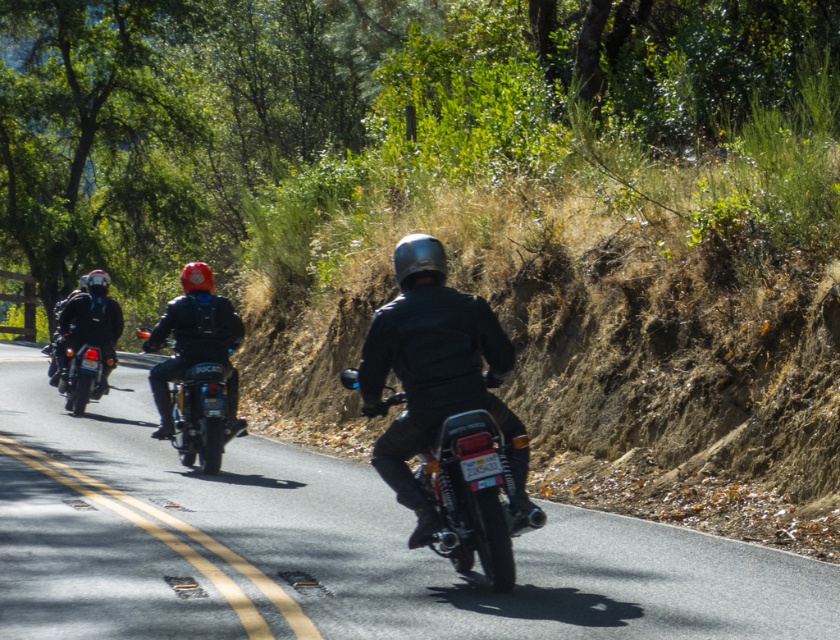
Can you confirm if shiny chrome motorcycle at center is smaller than shiny black motorcycle at left?

Yes, shiny chrome motorcycle at center is smaller than shiny black motorcycle at left.

Is point (499, 502) behind point (69, 403)?

That is False.

Locate an element on the screen. shiny chrome motorcycle at center is located at coordinates (475, 493).

Is shiny black motorcycle at center behind shiny black motorcycle at left?

That is False.

Which is in front, point (206, 412) or point (77, 406)?

Positioned in front is point (206, 412).

Locate an element on the screen. The width and height of the screenshot is (840, 640). shiny black motorcycle at center is located at coordinates (202, 416).

Which is behind, point (630, 592) or point (200, 410)?

Point (200, 410)

I want to click on black asphalt road at center, so click(328, 547).